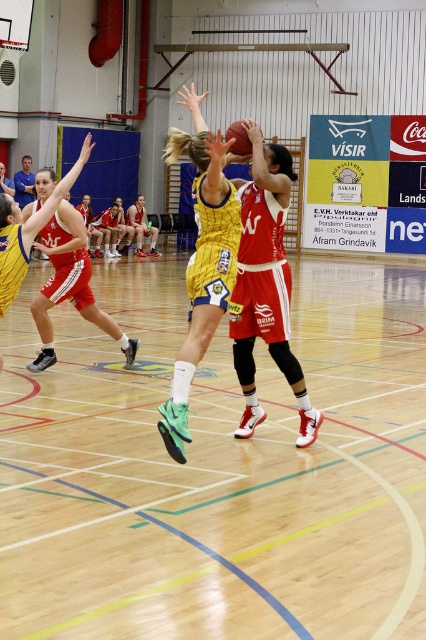
You are a sports analyst watching the game. You notice the yellow jersey at center and the rubber textured basketball at center. Which object appears larger in the image?

The yellow jersey at center appears larger than the rubber textured basketball at center in the image.